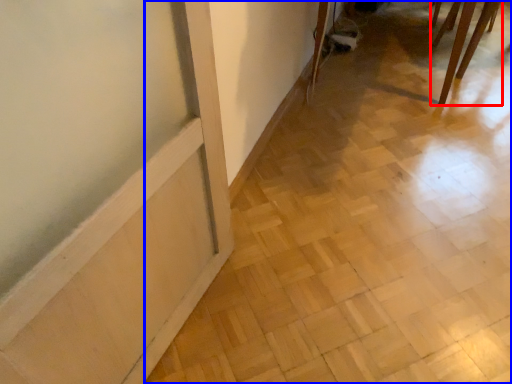
Question: Among these objects, which one is nearest to the camera, furniture (highlighted by a red box) or tile (highlighted by a blue box)?

Choices:
 (A) furniture
 (B) tile

Answer: (B)